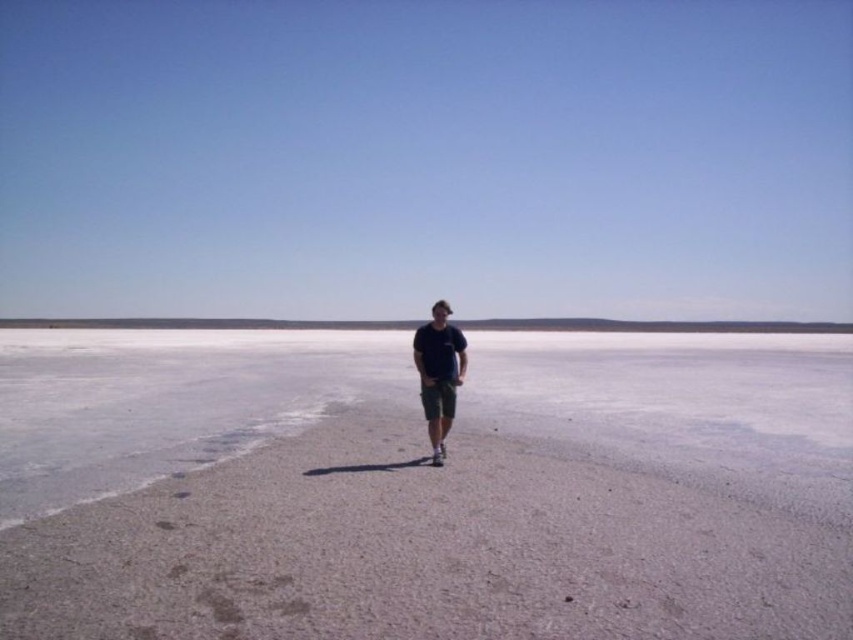
Question: Among these objects, which one is farthest from the camera?

Choices:
 (A) matte dark blue shirt at center
 (B) white sand at center

Answer: (A)

Question: Does white sand at center appear over green cotton shorts at center?

Choices:
 (A) no
 (B) yes

Answer: (A)

Question: Observing the image, what is the correct spatial positioning of white sand at center in reference to matte dark blue shirt at center?

Choices:
 (A) left
 (B) right

Answer: (A)

Question: Can you confirm if matte dark blue shirt at center is thinner than green cotton shorts at center?

Choices:
 (A) yes
 (B) no

Answer: (B)

Question: Estimate the real-world distances between objects in this image. Which object is farther from the matte dark blue shirt at center?

Choices:
 (A) white sand at center
 (B) green cotton shorts at center

Answer: (A)

Question: Which of the following is the farthest from the observer?

Choices:
 (A) tap(434, 339)
 (B) tap(450, 416)

Answer: (B)